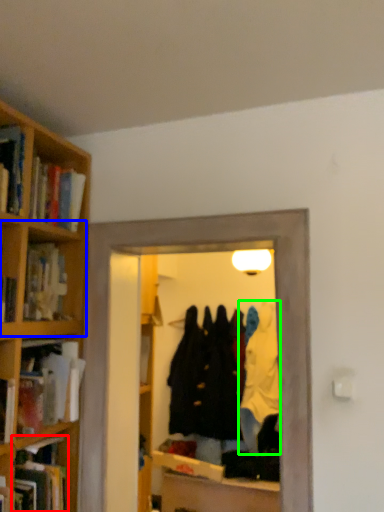
Question: Which object is the farthest from book (highlighted by a red box)? Choose among these: cabinet (highlighted by a blue box) or clothing (highlighted by a green box).

Choices:
 (A) cabinet
 (B) clothing

Answer: (B)